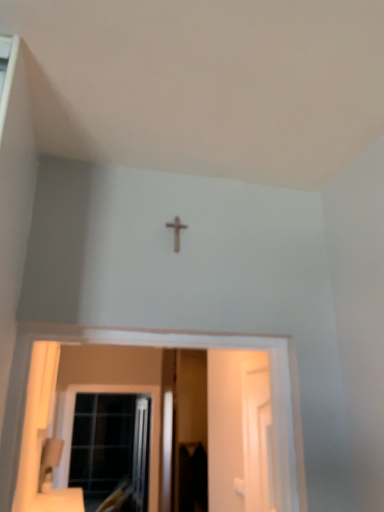
You are a GUI agent. You are given a task and a screenshot of the screen. Output one action in this format:
    pyautogui.click(x=<x>, y=<y>)
    Task: Click on the clear glass window at lower left
    This screenshot has height=512, width=384.
    Given the screenshot: What is the action you would take?
    pyautogui.click(x=111, y=447)

Describe the element at coordinates (111, 447) in the screenshot. This screenshot has height=512, width=384. I see `clear glass window at lower left` at that location.

Find the location of `wooden cross at center`. wooden cross at center is located at coordinates pyautogui.click(x=176, y=232).

Locate an element on the screen. Image resolution: width=384 pixels, height=512 pixels. white glossy screen door at right, the 2th screen door from the back is located at coordinates (257, 438).

Would you say white glossy screen door at right, the 2th screen door from the back, is part of transparent plastic screen door at center, which appears as the 1th screen door when viewed from the back,'s contents?

No, white glossy screen door at right, the 2th screen door from the back, is not surrounded by transparent plastic screen door at center, which appears as the 1th screen door when viewed from the back.

Considering their positions, is transparent plastic screen door at center, which ranks as the second screen door in front-to-back order, located in front of or behind white glossy screen door at right, acting as the first screen door starting from the front?

transparent plastic screen door at center, which ranks as the second screen door in front-to-back order, is behind white glossy screen door at right, acting as the first screen door starting from the front.

From the image's perspective, is transparent plastic screen door at center, which ranks as the second screen door in right-to-left order, under white glossy screen door at right, the second screen door positioned from the left?

Correct, transparent plastic screen door at center, which ranks as the second screen door in right-to-left order, appears lower than white glossy screen door at right, the second screen door positioned from the left, in the image.

Can you tell me how much transparent plastic screen door at center, which ranks as the second screen door in right-to-left order, and white glossy screen door at right, the 2th screen door from the back, differ in facing direction?

transparent plastic screen door at center, which ranks as the second screen door in right-to-left order, and white glossy screen door at right, the 2th screen door from the back, are facing 89.6 degrees away from each other.

How many degrees apart are the facing directions of clear glass window at lower left and transparent plastic screen door at center, which appears as the 1th screen door when viewed from the back?

clear glass window at lower left and transparent plastic screen door at center, which appears as the 1th screen door when viewed from the back, are facing 0.745 degrees away from each other.

Could you tell me if clear glass window at lower left is facing transparent plastic screen door at center, which appears as the 1th screen door when viewed from the back?

No, clear glass window at lower left is not oriented towards transparent plastic screen door at center, which appears as the 1th screen door when viewed from the back.

Image resolution: width=384 pixels, height=512 pixels. There is a clear glass window at lower left. What are the coordinates of `the 1st screen door above it (from the image's perspective)` in the screenshot? It's located at (191, 432).

Is clear glass window at lower left aimed at white glossy screen door at right, the 2th screen door from the back?

Yes, clear glass window at lower left is aimed at white glossy screen door at right, the 2th screen door from the back.

In the scene shown: Does clear glass window at lower left touch white glossy screen door at right, the 2th screen door from the back?

clear glass window at lower left and white glossy screen door at right, the 2th screen door from the back, are not in contact.

From the clear glass window at lower left, count 2nd screen door to the right and point to it. Please provide its 2D coordinates.

[(257, 438)]

Which is correct: clear glass window at lower left is inside white glossy screen door at right, the 2th screen door from the back, or outside of it?

clear glass window at lower left is not enclosed by white glossy screen door at right, the 2th screen door from the back.

Is white glossy screen door at right, the 1th screen door when ordered from right to left, placed right next to wooden cross at center?

No, white glossy screen door at right, the 1th screen door when ordered from right to left, is not making contact with wooden cross at center.

Can you confirm if white glossy screen door at right, the 2th screen door from the back, is positioned to the left of wooden cross at center?

No.

Identify the location of crucifix above the white glossy screen door at right, acting as the first screen door starting from the front (from the image's perspective). This screenshot has width=384, height=512. (176, 232).

Does clear glass window at lower left appear on the left side of wooden cross at center?

Correct, you'll find clear glass window at lower left to the left of wooden cross at center.

From the image's perspective, which one is positioned higher, clear glass window at lower left or wooden cross at center?

wooden cross at center, from the image's perspective.

How far apart are clear glass window at lower left and wooden cross at center?

clear glass window at lower left and wooden cross at center are 12.60 feet apart from each other.

Is wooden cross at center completely or partially outside of clear glass window at lower left?

wooden cross at center is positioned outside clear glass window at lower left.

From a real-world perspective, is wooden cross at center positioned over clear glass window at lower left based on gravity?

Yes, from a real-world perspective, wooden cross at center is over clear glass window at lower left

Based on their sizes in the image, would you say wooden cross at center is bigger or smaller than clear glass window at lower left?

Considering their sizes, wooden cross at center takes up less space than clear glass window at lower left.

Between white glossy screen door at right, the second screen door positioned from the left, and clear glass window at lower left, which one has smaller width?

white glossy screen door at right, the second screen door positioned from the left, is thinner.

Considering the relative sizes of white glossy screen door at right, acting as the first screen door starting from the front, and clear glass window at lower left in the image provided, is white glossy screen door at right, acting as the first screen door starting from the front, bigger than clear glass window at lower left?

No, white glossy screen door at right, acting as the first screen door starting from the front, is not bigger than clear glass window at lower left.

In the scene shown: Does white glossy screen door at right, acting as the first screen door starting from the front, turn towards clear glass window at lower left?

No, white glossy screen door at right, acting as the first screen door starting from the front, is not turned towards clear glass window at lower left.

What's the angular difference between white glossy screen door at right, the 1th screen door when ordered from right to left, and clear glass window at lower left's facing directions?

88.8 degrees.

This screenshot has width=384, height=512. What are the coordinates of `screen door in front of the transparent plastic screen door at center, which ranks as the second screen door in right-to-left order` in the screenshot? It's located at (257, 438).

Locate an element on the screen. screen door that is the 1st object above the clear glass window at lower left (from a real-world perspective) is located at coordinates coord(191,432).

Based on the photo, when comparing their distances from wooden cross at center, does white glossy screen door at right, the 1th screen door when ordered from right to left, or clear glass window at lower left seem closer?

white glossy screen door at right, the 1th screen door when ordered from right to left, is closer to wooden cross at center.

Considering their positions, is wooden cross at center positioned closer to white glossy screen door at right, the second screen door positioned from the left, than clear glass window at lower left?

The object closer to white glossy screen door at right, the second screen door positioned from the left, is wooden cross at center.

In the scene shown: Which object lies further to the anchor point transparent plastic screen door at center, which ranks as the second screen door in front-to-back order, clear glass window at lower left or wooden cross at center?

wooden cross at center is positioned further to the anchor transparent plastic screen door at center, which ranks as the second screen door in front-to-back order.

Based on their spatial positions, is transparent plastic screen door at center, which appears as the 1th screen door when viewed from the back, or clear glass window at lower left closer to wooden cross at center?

Among the two, transparent plastic screen door at center, which appears as the 1th screen door when viewed from the back, is located nearer to wooden cross at center.

Considering their positions, is white glossy screen door at right, the 2th screen door from the back, positioned closer to transparent plastic screen door at center, which ranks as the second screen door in front-to-back order, than clear glass window at lower left?

clear glass window at lower left is closer to transparent plastic screen door at center, which ranks as the second screen door in front-to-back order.

Which object lies nearer to the anchor point white glossy screen door at right, the 1th screen door when ordered from right to left, clear glass window at lower left or wooden cross at center?

wooden cross at center lies closer to white glossy screen door at right, the 1th screen door when ordered from right to left, than the other object.

Estimate the real-world distances between objects in this image. Which object is closer to transparent plastic screen door at center, which appears as the 1th screen door when viewed from the back, white glossy screen door at right, the second screen door positioned from the left, or wooden cross at center?

white glossy screen door at right, the second screen door positioned from the left, lies closer to transparent plastic screen door at center, which appears as the 1th screen door when viewed from the back, than the other object.

Looking at the image, which one is located closer to white glossy screen door at right, the 1th screen door when ordered from right to left, transparent plastic screen door at center, which ranks as the second screen door in right-to-left order, or wooden cross at center?

wooden cross at center is positioned closer to the anchor white glossy screen door at right, the 1th screen door when ordered from right to left.

The width and height of the screenshot is (384, 512). I want to click on screen door between white glossy screen door at right, the 2th screen door from the back, and clear glass window at lower left in the front-back direction, so click(x=191, y=432).

Identify the location of screen door located between wooden cross at center and transparent plastic screen door at center, arranged as the first screen door when viewed from the left, in the depth direction. This screenshot has height=512, width=384. (257, 438).